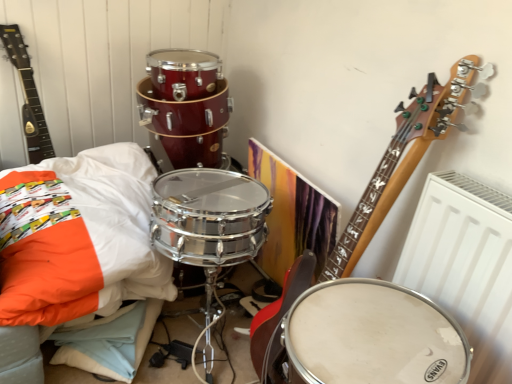
Question: In terms of width, does white soft pillow at lower left look wider or thinner when compared to white matte drum at center?

Choices:
 (A) thin
 (B) wide

Answer: (B)

Question: Considering the positions of point (80, 278) and point (320, 360), is point (80, 278) closer or farther from the camera than point (320, 360)?

Choices:
 (A) closer
 (B) farther

Answer: (B)

Question: Which is nearer to the white matte drum at center?

Choices:
 (A) matte black guitar at upper left
 (B) white soft pillow at lower left

Answer: (B)

Question: Which object is the closest to the white matte drum at center?

Choices:
 (A) matte black guitar at upper left
 (B) white soft pillow at lower left

Answer: (B)